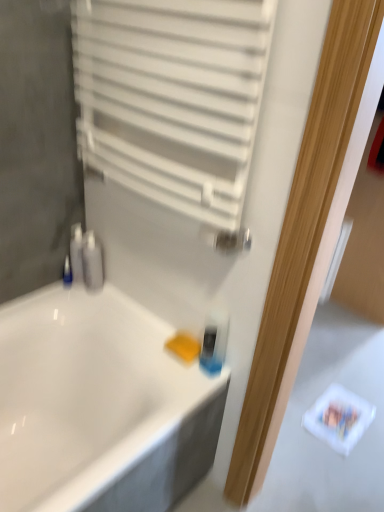
Question: From a real-world perspective, is white glossy bathtub at center under white matte radiator at upper center?

Choices:
 (A) no
 (B) yes

Answer: (B)

Question: Is white glossy bathtub at center behind white matte radiator at upper center?

Choices:
 (A) yes
 (B) no

Answer: (A)

Question: Is white matte radiator at upper center at the back of white glossy bathtub at center?

Choices:
 (A) yes
 (B) no

Answer: (B)

Question: Does white glossy bathtub at center have a greater width compared to white matte radiator at upper center?

Choices:
 (A) no
 (B) yes

Answer: (B)

Question: From a real-world perspective, is white glossy bathtub at center on white matte radiator at upper center?

Choices:
 (A) yes
 (B) no

Answer: (B)

Question: Looking at their shapes, would you say white matte radiator at upper center is wider or thinner than yellow sponge at lower center?

Choices:
 (A) wide
 (B) thin

Answer: (A)

Question: Does point (87, 82) appear closer or farther from the camera than point (193, 338)?

Choices:
 (A) farther
 (B) closer

Answer: (B)

Question: Visually, is white matte radiator at upper center positioned to the left or to the right of yellow sponge at lower center?

Choices:
 (A) right
 (B) left

Answer: (B)

Question: In the image, is white matte radiator at upper center positioned in front of or behind yellow sponge at lower center?

Choices:
 (A) front
 (B) behind

Answer: (A)

Question: Based on their positions, is blue plastic bottle at left, which is the first toiletry in left-to-right order, located to the left or right of white matte radiator at upper center?

Choices:
 (A) left
 (B) right

Answer: (A)

Question: In terms of height, does blue plastic bottle at left, which is the first toiletry in left-to-right order, look taller or shorter compared to white matte radiator at upper center?

Choices:
 (A) short
 (B) tall

Answer: (A)

Question: In terms of width, does blue plastic bottle at left, which appears as the 2th toiletry when viewed from the right, look wider or thinner when compared to white matte radiator at upper center?

Choices:
 (A) wide
 (B) thin

Answer: (B)

Question: From the image's perspective, is blue plastic bottle at left, which appears as the 2th toiletry when viewed from the right, above or below white matte radiator at upper center?

Choices:
 (A) above
 (B) below

Answer: (B)

Question: In terms of width, does yellow sponge at lower center look wider or thinner when compared to satin silver soap dispenser at left, positioned as the 2th toiletry in left-to-right order?

Choices:
 (A) thin
 (B) wide

Answer: (B)

Question: Considering the positions of yellow sponge at lower center and satin silver soap dispenser at left, positioned as the 2th toiletry in left-to-right order, in the image, is yellow sponge at lower center taller or shorter than satin silver soap dispenser at left, positioned as the 2th toiletry in left-to-right order,?

Choices:
 (A) short
 (B) tall

Answer: (A)